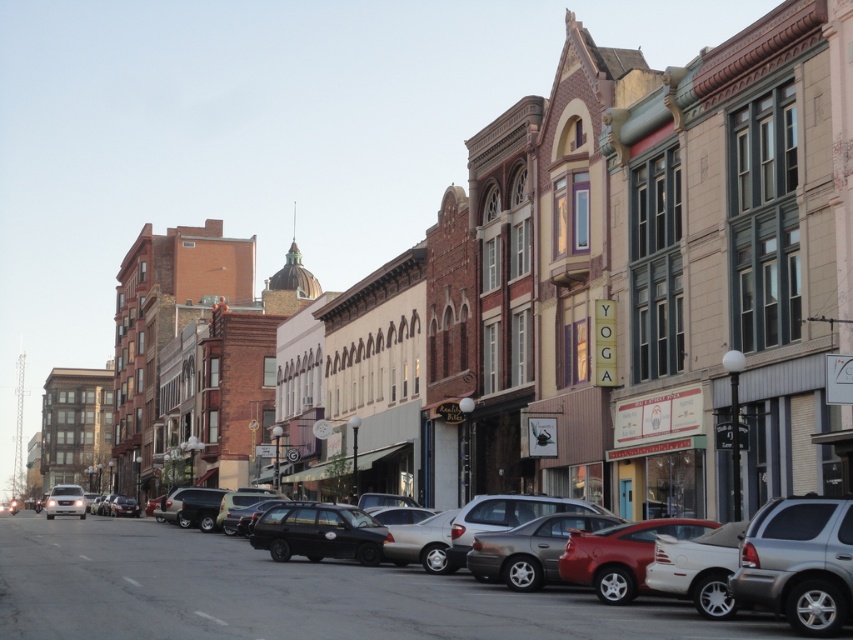
Question: Estimate the real-world distances between objects in this image. Which object is closer to the black matte sedan at center?

Choices:
 (A) shiny red car at center
 (B) silver metallic suv at lower right

Answer: (A)

Question: Does black matte sedan at center have a lesser width compared to shiny red car at center?

Choices:
 (A) yes
 (B) no

Answer: (B)

Question: Which of the following is the closest to the observer?

Choices:
 (A) silver metallic suv at lower right
 (B) black matte sedan at center
 (C) shiny red car at center

Answer: (B)

Question: Among these points, which one is nearest to the camera?

Choices:
 (A) (643, 573)
 (B) (242, 602)
 (C) (817, 515)

Answer: (C)

Question: Is black matte sedan at center thinner than silver metallic suv at lower right?

Choices:
 (A) yes
 (B) no

Answer: (B)

Question: Does black matte sedan at center have a smaller size compared to shiny red car at center?

Choices:
 (A) yes
 (B) no

Answer: (B)